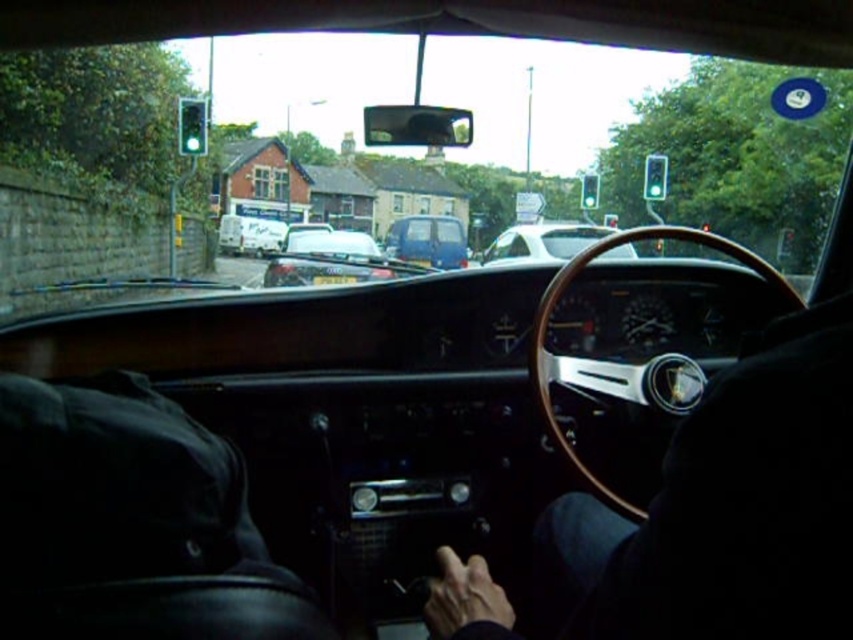
Question: Which point is closer to the camera taking this photo?

Choices:
 (A) (523, 259)
 (B) (659, 608)
 (C) (195, 124)

Answer: (B)

Question: Which point appears closest to the camera in this image?

Choices:
 (A) (190, 144)
 (B) (584, 208)
 (C) (647, 179)

Answer: (A)

Question: Where is blue matte van at center located in relation to green glass traffic light at upper right in the image?

Choices:
 (A) below
 (B) above

Answer: (A)

Question: Is wooden/leather steering wheel at center above green glass traffic light at upper left?

Choices:
 (A) yes
 (B) no

Answer: (B)

Question: Which point is farther to the camera?

Choices:
 (A) (582, 180)
 (B) (642, 588)
 (C) (538, 241)
 (D) (456, 218)

Answer: (D)

Question: Is black leather hand at center smaller than green glass traffic light at center?

Choices:
 (A) yes
 (B) no

Answer: (A)